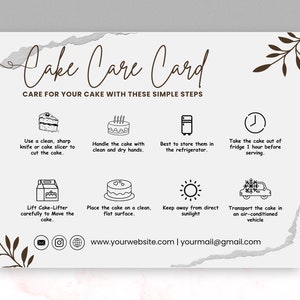
You are a GUI agent. You are given a task and a screenshot of the screen. Output one action in this format:
    pyautogui.click(x=<x>, y=<y>)
    Task: Click on the gray stain adornments
    
    Given the screenshot: What is the action you would take?
    pyautogui.click(x=85, y=37), pyautogui.click(x=265, y=248)